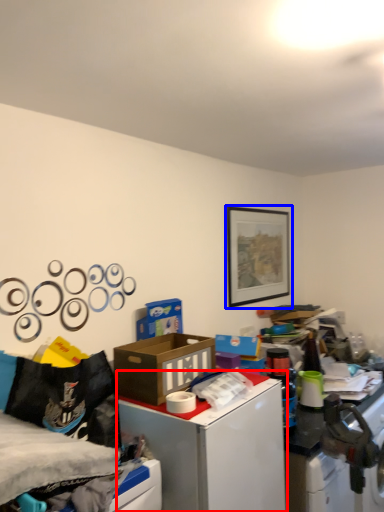
Question: Which object is closer to the camera taking this photo, table (highlighted by a red box) or picture frame (highlighted by a blue box)?

Choices:
 (A) table
 (B) picture frame

Answer: (A)